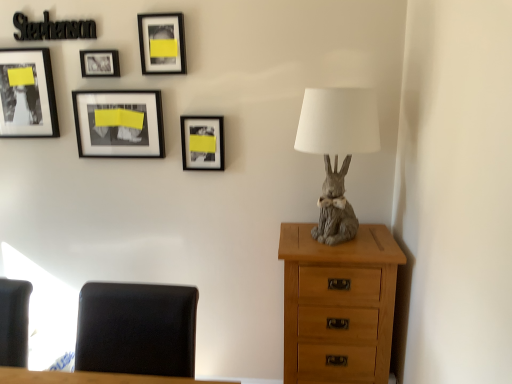
Question: In which direction should I rotate to look at matte black picture frame at center, which is the first picture frame in right-to-left order?

Choices:
 (A) right
 (B) left

Answer: (B)

Question: Is matte black frame at upper left, the fifth picture frame in the right-to-left sequence, smaller than black leather chair at lower left?

Choices:
 (A) no
 (B) yes

Answer: (B)

Question: Is matte black frame at upper left, which ranks as the first picture frame in left-to-right order, positioned behind black leather chair at lower left?

Choices:
 (A) yes
 (B) no

Answer: (A)

Question: Considering the relative sizes of matte black frame at upper left, which ranks as the first picture frame in left-to-right order, and black leather chair at lower left in the image provided, is matte black frame at upper left, which ranks as the first picture frame in left-to-right order, bigger than black leather chair at lower left?

Choices:
 (A) yes
 (B) no

Answer: (B)

Question: Can you confirm if matte black frame at upper left, which ranks as the first picture frame in left-to-right order, is taller than black leather chair at lower left?

Choices:
 (A) yes
 (B) no

Answer: (B)

Question: Is matte black frame at upper left, the fifth picture frame in the right-to-left sequence, to the left of black leather chair at lower left from the viewer's perspective?

Choices:
 (A) yes
 (B) no

Answer: (A)

Question: Is matte black frame at upper left, which ranks as the first picture frame in left-to-right order, facing away from black leather chair at lower left?

Choices:
 (A) yes
 (B) no

Answer: (B)

Question: Is matte black frame at upper left, which ranks as the first picture frame in left-to-right order, shorter than matte black frame at upper center, which is counted as the 2th picture frame, starting from the right?

Choices:
 (A) no
 (B) yes

Answer: (A)

Question: From a real-world perspective, is matte black frame at upper left, which ranks as the first picture frame in left-to-right order, positioned under matte black frame at upper center, which is counted as the 2th picture frame, starting from the right, based on gravity?

Choices:
 (A) yes
 (B) no

Answer: (A)

Question: From a real-world perspective, is matte black frame at upper left, which ranks as the first picture frame in left-to-right order, on top of matte black frame at upper center, marked as the 4th picture frame in a left-to-right arrangement?

Choices:
 (A) no
 (B) yes

Answer: (A)

Question: Can you see matte black frame at upper left, the fifth picture frame in the right-to-left sequence, touching matte black frame at upper center, marked as the 4th picture frame in a left-to-right arrangement?

Choices:
 (A) yes
 (B) no

Answer: (B)

Question: Considering the relative sizes of matte black frame at upper left, which ranks as the first picture frame in left-to-right order, and matte black frame at upper center, marked as the 4th picture frame in a left-to-right arrangement, in the image provided, is matte black frame at upper left, which ranks as the first picture frame in left-to-right order, taller than matte black frame at upper center, marked as the 4th picture frame in a left-to-right arrangement,?

Choices:
 (A) yes
 (B) no

Answer: (A)

Question: Is matte black frame at upper left, which ranks as the first picture frame in left-to-right order, thinner than matte black frame at upper center, marked as the 4th picture frame in a left-to-right arrangement?

Choices:
 (A) yes
 (B) no

Answer: (B)

Question: Can you confirm if light brown wood chest of drawers at right is taller than matte black frame at upper left, which ranks as the first picture frame in left-to-right order?

Choices:
 (A) yes
 (B) no

Answer: (A)